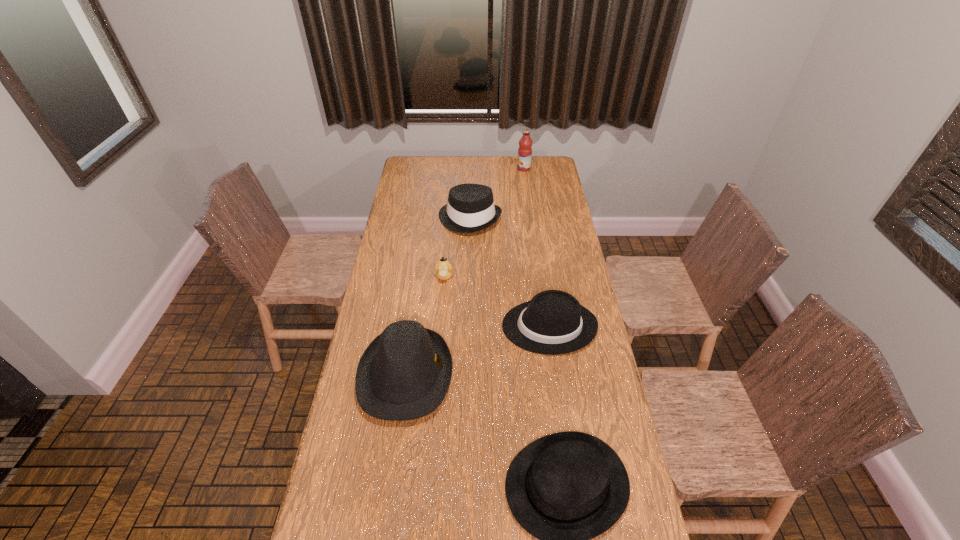
Identify the location of free space at the right edge of the desktop. The height and width of the screenshot is (540, 960). (554, 214).

Identify the location of vacant position at the far left corner of the desktop. Image resolution: width=960 pixels, height=540 pixels. (432, 165).

You are a GUI agent. You are given a task and a screenshot of the screen. Output one action in this format:
    pyautogui.click(x=<x>, y=<y>)
    Task: Click on the free space at the far right corner of the desktop
    
    Given the screenshot: What is the action you would take?
    pyautogui.click(x=540, y=161)

Locate an element on the screen. This screenshot has width=960, height=540. free space between the third shortest object and the farthest fedora is located at coordinates (510, 273).

What are the coordinates of `vacant region between the farthest object and the third shortest object` in the screenshot? It's located at click(x=537, y=247).

Identify the location of free area in between the duckling and the second shortest fedora. (496, 301).

Locate an element on the screen. object that is the closest one to the nearest fedora is located at coordinates (404, 374).

What are the coordinates of `object identified as the fifth closest to the fruit juice` in the screenshot? It's located at (566, 488).

In order to click on fedora that is the third closest to the third tallest fedora in this screenshot , I will do `click(470, 208)`.

Locate an element on the screen. The width and height of the screenshot is (960, 540). the fourth closest fedora relative to the fruit juice is located at coordinates (566, 488).